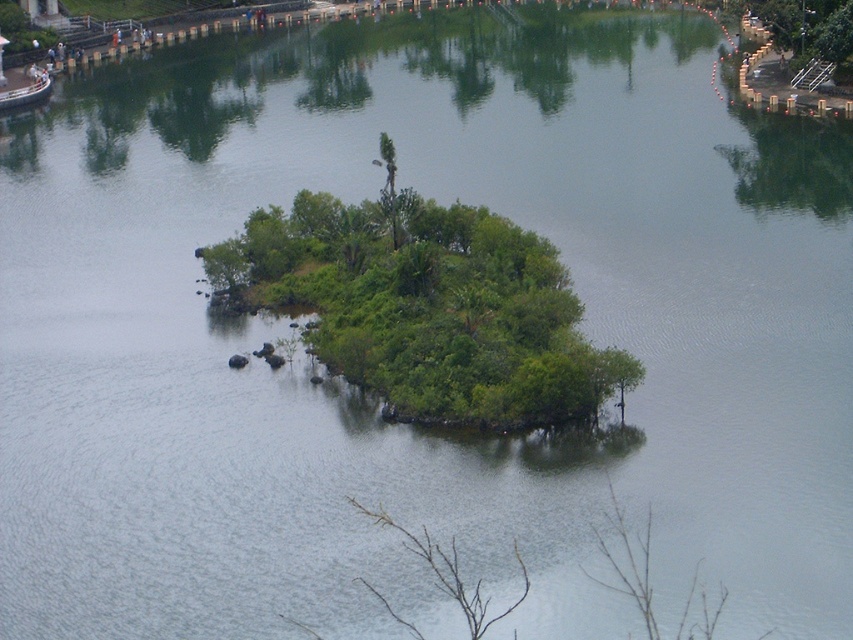
Question: Where is green leafy tree at center located in relation to metallic silver boat at upper left in the image?

Choices:
 (A) below
 (B) above

Answer: (A)

Question: Which object is closer to the camera taking this photo?

Choices:
 (A) green leafy tree at center
 (B) metallic silver boat at upper left

Answer: (A)

Question: Is green leafy tree at center bigger than metallic silver boat at upper left?

Choices:
 (A) no
 (B) yes

Answer: (B)

Question: Observing the image, what is the correct spatial positioning of green leafy tree at center in reference to metallic silver boat at upper left?

Choices:
 (A) left
 (B) right

Answer: (B)